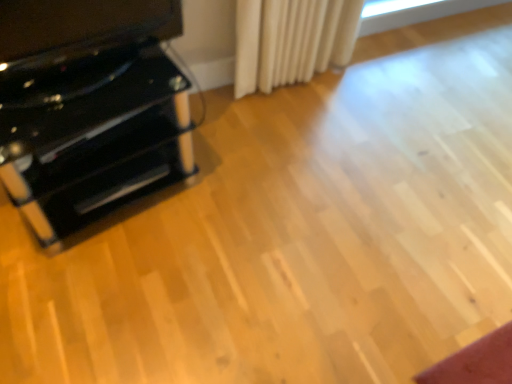
You are a GUI agent. You are given a task and a screenshot of the screen. Output one action in this format:
    pyautogui.click(x=<x>, y=<y>)
    Task: Click on the black glossy tv stand at left
    
    Given the screenshot: What is the action you would take?
    pyautogui.click(x=80, y=26)

What are the coordinates of `black plastic drawer at left` in the screenshot? It's located at (119, 185).

Does black glossy tv stand at left have a lesser height compared to glossy black cabinet at left?

Correct, black glossy tv stand at left is not as tall as glossy black cabinet at left.

Considering the positions of points (127, 5) and (85, 188), is point (127, 5) farther from camera compared to point (85, 188)?

No.

Is black glossy tv stand at left oriented away from glossy black cabinet at left?

That's not correct — black glossy tv stand at left is not looking away from glossy black cabinet at left.

Would you say black glossy tv stand at left is inside or outside glossy black cabinet at left?

black glossy tv stand at left is not enclosed by glossy black cabinet at left.

From the image's perspective, who appears lower, black glossy tv stand at left or black plastic drawer at left?

black plastic drawer at left, from the image's perspective.

Is black glossy tv stand at left next to black plastic drawer at left and touching it?

No, black glossy tv stand at left is not making contact with black plastic drawer at left.

Can you confirm if black glossy tv stand at left is positioned to the right of black plastic drawer at left?

Yes, black glossy tv stand at left is to the right of black plastic drawer at left.

I want to click on wide above the black plastic drawer at left (from a real-world perspective), so click(80, 26).

Looking at this image, is glossy black cabinet at left shorter than black plastic drawer at left?

No.

Who is bigger, glossy black cabinet at left or black plastic drawer at left?

glossy black cabinet at left is bigger.

Considering the relative sizes of glossy black cabinet at left and black plastic drawer at left in the image provided, is glossy black cabinet at left thinner than black plastic drawer at left?

No, glossy black cabinet at left is not thinner than black plastic drawer at left.

Between black plastic drawer at left and black glossy tv stand at left, which one has larger width?

black plastic drawer at left.

Is black plastic drawer at left completely or partially outside of black glossy tv stand at left?

That's correct, black plastic drawer at left is outside of black glossy tv stand at left.

Which object is positioned more to the right, glossy black cabinet at left or black glossy tv stand at left?

From the viewer's perspective, black glossy tv stand at left appears more on the right side.

Between glossy black cabinet at left and black glossy tv stand at left, which one has larger size?

Bigger between the two is glossy black cabinet at left.

Which is nearer, [154,18] or [99,25]?

Clearly, point [154,18] is more distant from the camera than point [99,25].

Is glossy black cabinet at left taller or shorter than black glossy tv stand at left?

glossy black cabinet at left is taller than black glossy tv stand at left.

What's the angular difference between black plastic drawer at left and glossy black cabinet at left's facing directions?

They differ by 0.32 degrees in their facing directions.

Does black plastic drawer at left have a greater height compared to glossy black cabinet at left?

No, black plastic drawer at left is not taller than glossy black cabinet at left.

Where is `furniture on the left of black plastic drawer at left`? Image resolution: width=512 pixels, height=384 pixels. furniture on the left of black plastic drawer at left is located at coordinates (89, 108).

Which is correct: black plastic drawer at left is inside glossy black cabinet at left, or outside of it?

black plastic drawer at left can be found inside glossy black cabinet at left.

Find the location of a particular element. furniture on the left of black glossy tv stand at left is located at coordinates (89, 108).

This screenshot has height=384, width=512. I want to click on wide above the black plastic drawer at left (from the image's perspective), so click(x=80, y=26).

Looking at the image, which one is located further to black glossy tv stand at left, black plastic drawer at left or glossy black cabinet at left?

Among the two, black plastic drawer at left is located further to black glossy tv stand at left.

From the image, which object appears to be farther from black glossy tv stand at left, glossy black cabinet at left or black plastic drawer at left?

black plastic drawer at left lies further to black glossy tv stand at left than the other object.

Estimate the real-world distances between objects in this image. Which object is further from black plastic drawer at left, black glossy tv stand at left or glossy black cabinet at left?

The object further to black plastic drawer at left is black glossy tv stand at left.

Which object lies nearer to the anchor point black plastic drawer at left, glossy black cabinet at left or black glossy tv stand at left?

glossy black cabinet at left is closer to black plastic drawer at left.

Based on their spatial positions, is black glossy tv stand at left or black plastic drawer at left closer to glossy black cabinet at left?

black plastic drawer at left lies closer to glossy black cabinet at left than the other object.

Considering their positions, is black plastic drawer at left positioned closer to glossy black cabinet at left than black glossy tv stand at left?

black plastic drawer at left lies closer to glossy black cabinet at left than the other object.

Locate an element on the screen. The image size is (512, 384). furniture between black glossy tv stand at left and black plastic drawer at left from front to back is located at coordinates (89, 108).